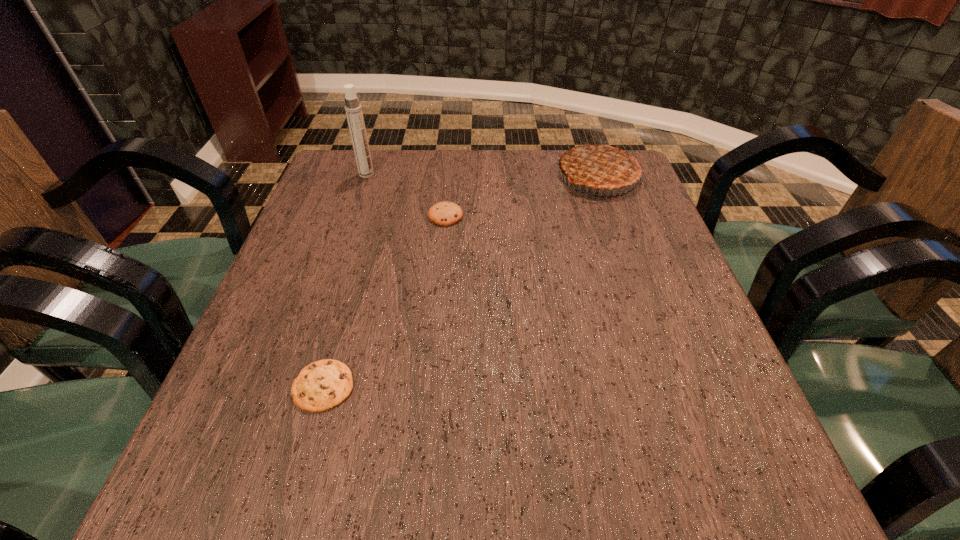
The height and width of the screenshot is (540, 960). I want to click on vacant space situated 0.100m on the back of the left cookie, so (x=343, y=318).

Locate an element on the screen. The height and width of the screenshot is (540, 960). aerosol can positioned at the far edge is located at coordinates (354, 114).

Identify the location of pie that is at the far edge. (604, 165).

Locate an element on the screen. The width and height of the screenshot is (960, 540). aerosol can located in the left edge section of the desktop is located at coordinates (354, 114).

Where is `cookie located in the left edge section of the desktop`? This screenshot has width=960, height=540. cookie located in the left edge section of the desktop is located at coordinates (322, 385).

The image size is (960, 540). Identify the location of object at the right edge. (604, 165).

Where is `object present at the far left corner`? The width and height of the screenshot is (960, 540). object present at the far left corner is located at coordinates (354, 114).

You are a GUI agent. You are given a task and a screenshot of the screen. Output one action in this format:
    pyautogui.click(x=<x>, y=<y>)
    Task: Click on the object that is at the far right corner
    
    Given the screenshot: What is the action you would take?
    pyautogui.click(x=604, y=165)

The width and height of the screenshot is (960, 540). Find the location of `vacant space at the far edge of the desktop`. vacant space at the far edge of the desktop is located at coordinates (410, 185).

The height and width of the screenshot is (540, 960). What are the coordinates of `free location at the near edge` in the screenshot? It's located at (403, 464).